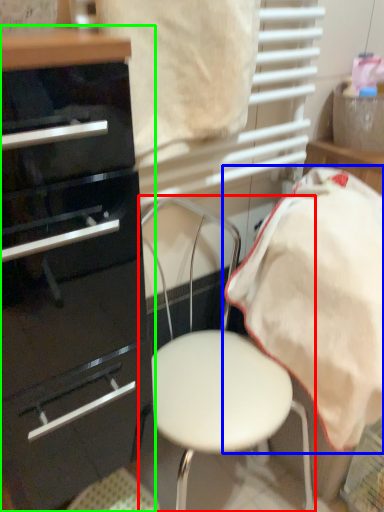
Question: Which object is positioned farthest from chair (highlighted by a red box)? Select from bedding (highlighted by a blue box) and chest of drawers (highlighted by a green box).

Choices:
 (A) bedding
 (B) chest of drawers

Answer: (B)